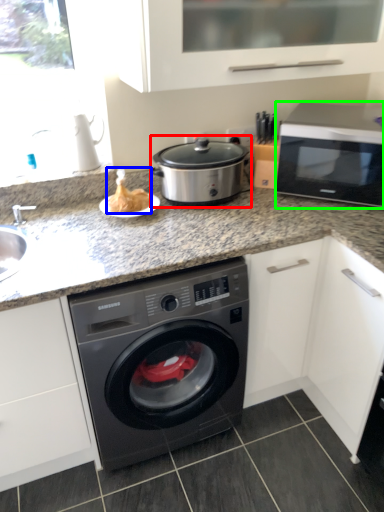
Question: Which object is the closest to the slow cooker (highlighted by a red box)? Choose among these: food (highlighted by a blue box) or microwave oven (highlighted by a green box).

Choices:
 (A) food
 (B) microwave oven

Answer: (A)